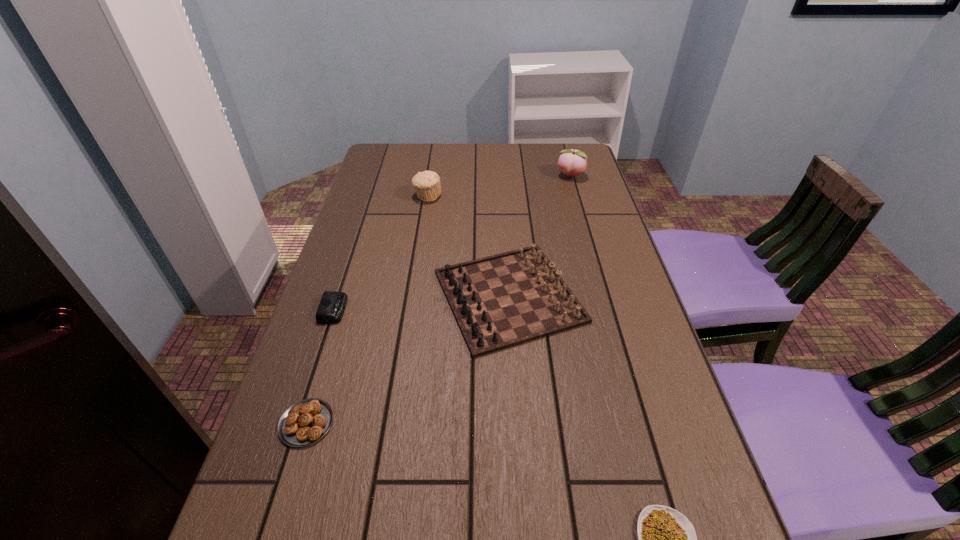
At what (x,y) coordinates should I click in order to perform the action: click on the tallest object. Please return your answer as a coordinate pair (x, y). The image size is (960, 540). Looking at the image, I should click on (572, 162).

Where is `peach`? peach is located at coordinates (572, 162).

At what (x,y) coordinates should I click in order to perform the action: click on the second tallest object. Please return your answer as a coordinate pair (x, y). The width and height of the screenshot is (960, 540). Looking at the image, I should click on (427, 183).

The height and width of the screenshot is (540, 960). What are the coordinates of `muffin` in the screenshot? It's located at (427, 183).

The height and width of the screenshot is (540, 960). What are the coordinates of `the third tallest object` in the screenshot? It's located at (503, 300).

Where is `pastry`? This screenshot has height=540, width=960. pastry is located at coordinates (305, 422).

Where is `alarm clock`? alarm clock is located at coordinates (332, 305).

The height and width of the screenshot is (540, 960). Identify the location of vacant space located on the left of the peach. pos(475,177).

In order to click on free location located on the back of the fifth nearest object in this screenshot , I will do `click(433, 163)`.

Locate an element on the screen. vacant space located on the left of the third tallest object is located at coordinates (369, 296).